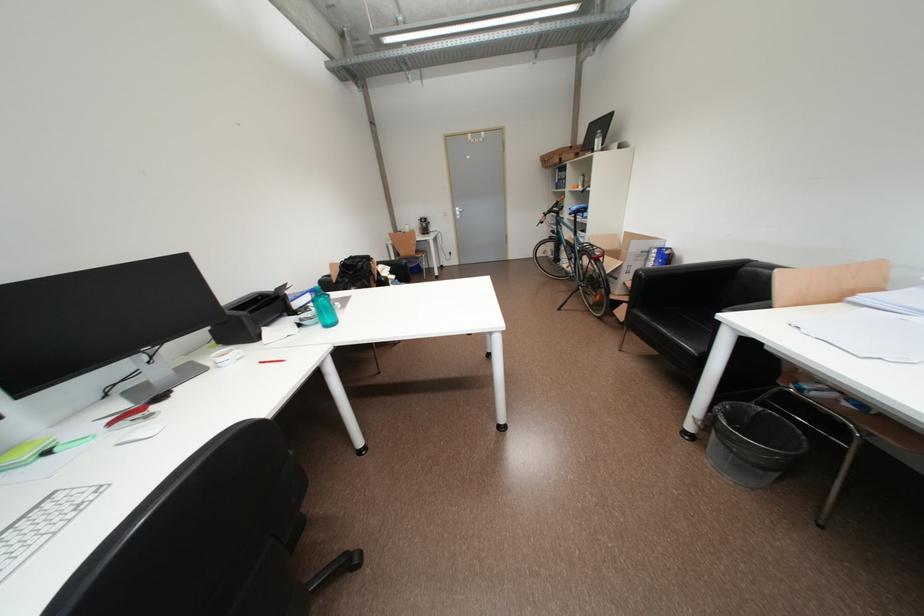
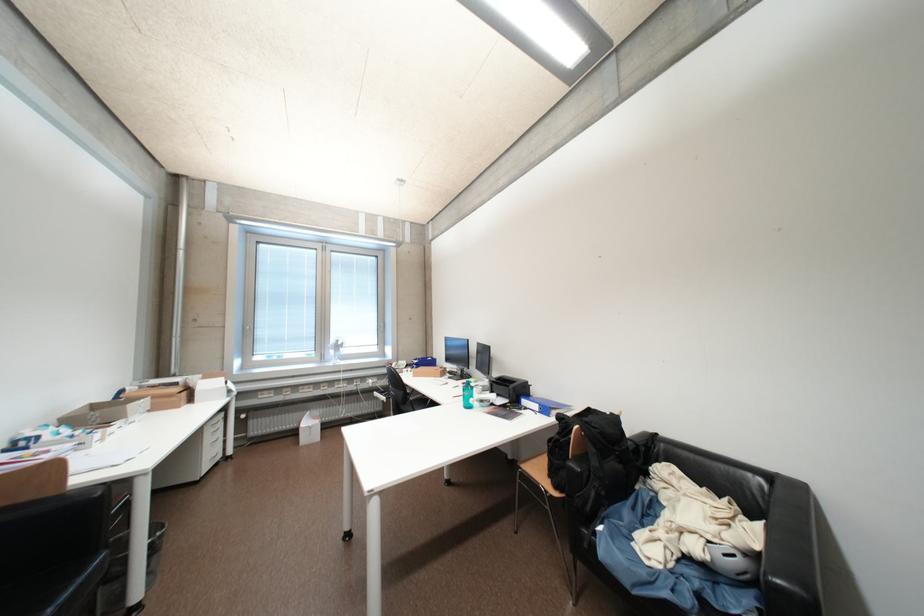
Find the pixel in the second image that matches [400,278] in the first image.

(704, 551)